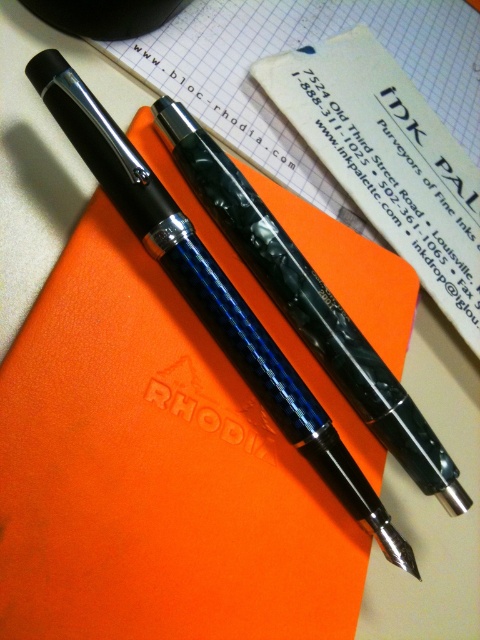
Which is more to the left, glossy blue pen at center or glossy black pen at center?

glossy blue pen at center

Does glossy blue pen at center appear on the left side of glossy black pen at center?

Yes, glossy blue pen at center is to the left of glossy black pen at center.

Is point (226, 301) positioned behind point (403, 420)?

No, (226, 301) is closer to viewer.

The height and width of the screenshot is (640, 480). Find the location of `glossy blue pen at center`. glossy blue pen at center is located at coordinates point(211,294).